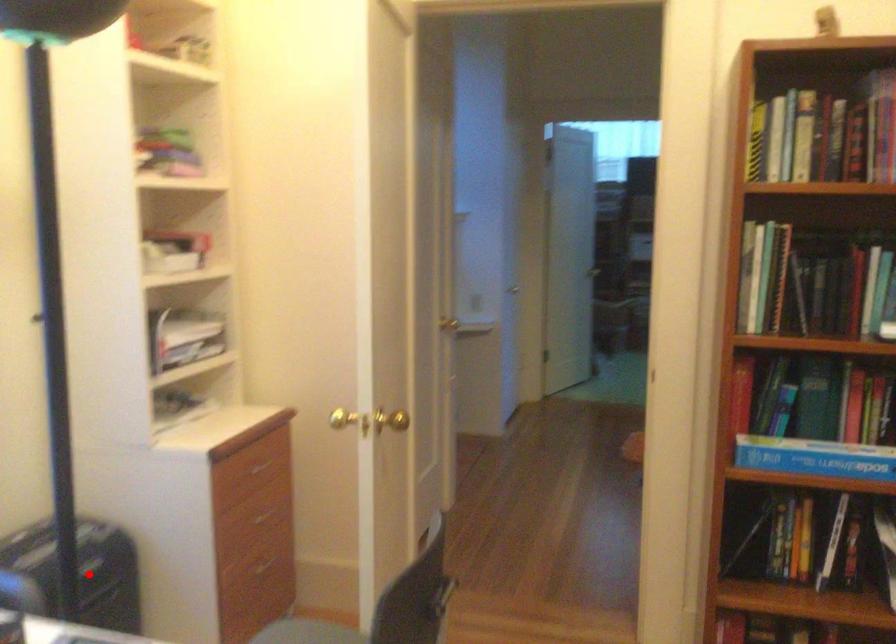
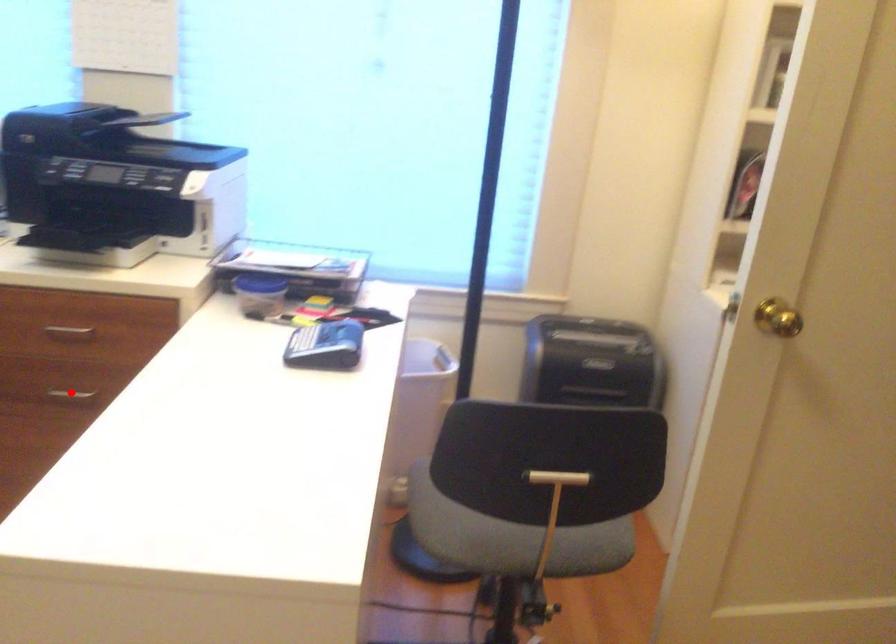
I am providing you with two images of the same scene from different viewpoints. A red point is marked on the first image and another point is marked on the second image. Do the highlighted points in image1 and image2 indicate the same real-world spot?

No